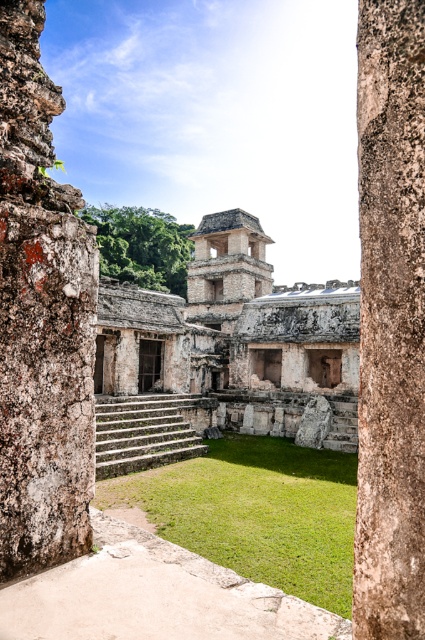
Which is above, rusty stone pillar at left or rough stone pillar at center?

Positioned higher is rusty stone pillar at left.

Between rusty stone pillar at left and rough stone pillar at center, which one has more height?

With more height is rusty stone pillar at left.

Identify the location of rusty stone pillar at left. The image size is (425, 640). (40, 317).

Is white stone ruins at center thinner than rough stone pillar at center?

No.

Which of these two, white stone ruins at center or rough stone pillar at center, stands taller?

white stone ruins at center

Who is more distant from viewer, (x=164, y=396) or (x=419, y=19)?

Point (x=164, y=396)

You are a GUI agent. You are given a task and a screenshot of the screen. Output one action in this format:
    pyautogui.click(x=<x>, y=<y>)
    Task: Click on the white stone ruins at center
    The height and width of the screenshot is (640, 425).
    Given the screenshot: What is the action you would take?
    pyautogui.click(x=223, y=355)

Who is lower down, white stone ruins at center or rusty stone pillar at left?

Positioned lower is rusty stone pillar at left.

This screenshot has height=640, width=425. Identify the location of white stone ruins at center. (223, 355).

You are a GUI agent. You are given a task and a screenshot of the screen. Output one action in this format:
    pyautogui.click(x=<x>, y=<y>)
    Task: Click on the white stone ruins at center
    This screenshot has width=425, height=640.
    Given the screenshot: What is the action you would take?
    pyautogui.click(x=223, y=355)